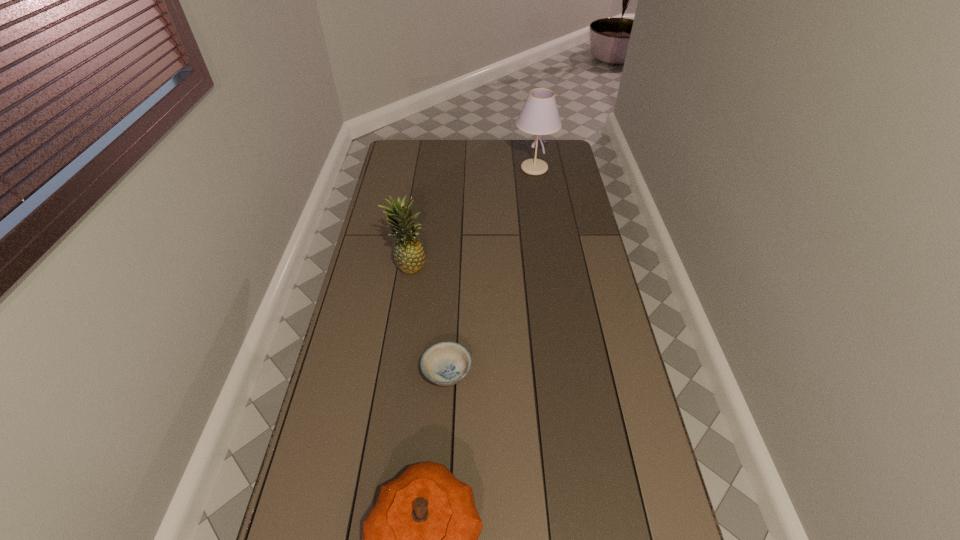
The height and width of the screenshot is (540, 960). Find the location of `object positioned at the left edge`. object positioned at the left edge is located at coordinates (409, 255).

Where is `object that is at the right edge`? The width and height of the screenshot is (960, 540). object that is at the right edge is located at coordinates (539, 116).

Identify the location of object that is at the far right corner. The width and height of the screenshot is (960, 540). (539, 116).

Where is `vacant area at the far edge of the desktop`? vacant area at the far edge of the desktop is located at coordinates (434, 148).

This screenshot has height=540, width=960. Find the location of `free space at the left edge of the desktop`. free space at the left edge of the desktop is located at coordinates (347, 436).

Identify the location of vacant space at the right edge of the desktop. (614, 368).

Identify the location of vacant space at the far left corner. (392, 154).

You are a GUI agent. You are given a task and a screenshot of the screen. Output one action in this format:
    pyautogui.click(x=<x>, y=<y>)
    Task: Click on the vacant space in between the farthest object and the second tallest object
    Image resolution: width=960 pixels, height=540 pixels.
    Given the screenshot: What is the action you would take?
    pyautogui.click(x=471, y=217)

Locate an element on the screen. This screenshot has height=540, width=960. empty space between the bowl and the pineapple is located at coordinates click(x=428, y=319).

Find the location of a particular element. The image size is (960, 540). free space between the pineapple and the third farthest object is located at coordinates (428, 319).